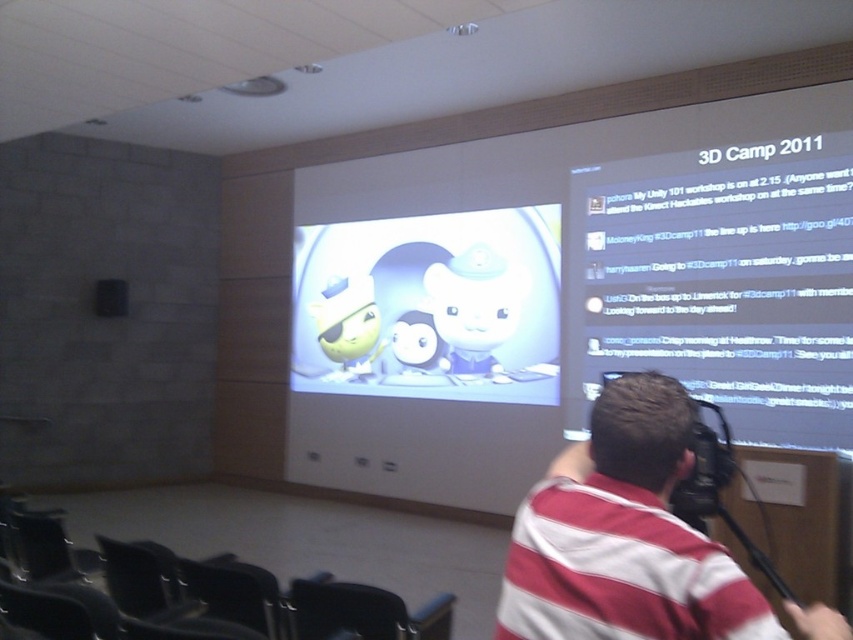
Describe the element at coordinates (624, 536) in the screenshot. The image size is (853, 640). I see `striped cotton shirt at center` at that location.

Between striped cotton shirt at center and black plastic chair at lower left, which one appears on the right side from the viewer's perspective?

From the viewer's perspective, striped cotton shirt at center appears more on the right side.

What are the coordinates of `striped cotton shirt at center` in the screenshot? It's located at (624, 536).

What do you see at coordinates (430, 307) in the screenshot? I see `matte cartoon characters at center` at bounding box center [430, 307].

Who is more distant from viewer, (549, 396) or (639, 595)?

Positioned behind is point (549, 396).

You are a GUI agent. You are given a task and a screenshot of the screen. Output one action in this format:
    pyautogui.click(x=<x>, y=<y>)
    Task: Click on the matte cartoon characters at center
    The width and height of the screenshot is (853, 640).
    Given the screenshot: What is the action you would take?
    pyautogui.click(x=430, y=307)

I want to click on matte cartoon characters at center, so click(430, 307).

Who is more forward, [390,362] or [694,403]?

Point [694,403]

Based on the photo, can you confirm if matte cartoon characters at center is wider than black plastic video camera at upper right?

Yes.

Does point (311, 380) come farther from viewer compared to point (695, 442)?

Yes, point (311, 380) is farther from viewer.

Where is `matte cartoon characters at center`? This screenshot has width=853, height=640. matte cartoon characters at center is located at coordinates (430, 307).